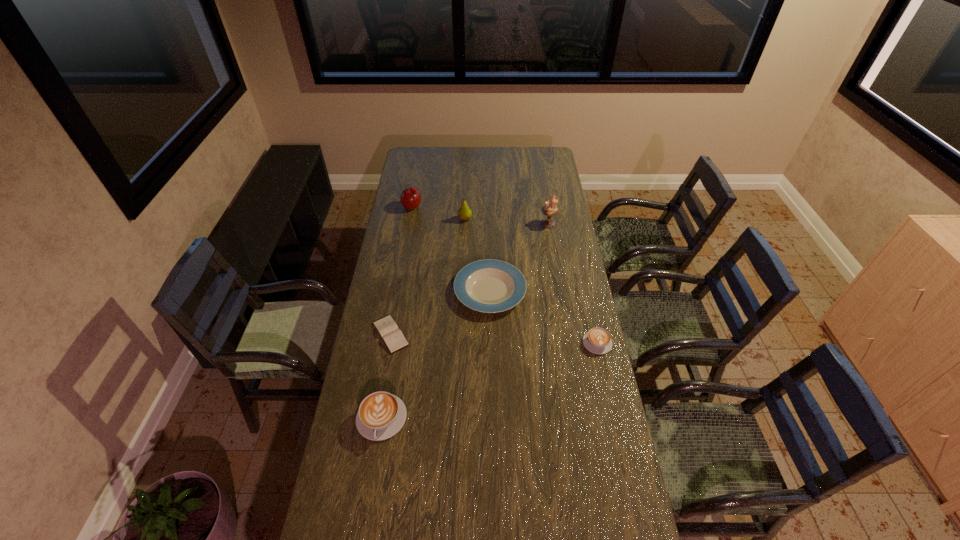
This screenshot has height=540, width=960. I want to click on the nearest object, so click(x=381, y=415).

Locate an element on the screen. Image resolution: width=960 pixels, height=540 pixels. the taller cappuccino is located at coordinates (381, 415).

Where is `the farther cappuccino`? This screenshot has height=540, width=960. the farther cappuccino is located at coordinates (597, 340).

Where is `the shorter cappuccino`? the shorter cappuccino is located at coordinates (597, 340).

What are the coordinates of `pear` in the screenshot? It's located at tap(465, 213).

Image resolution: width=960 pixels, height=540 pixels. In order to click on the sixth object from left to right in this screenshot , I will do [549, 210].

I want to click on the tallest object, so click(x=549, y=210).

Where is `apple`? This screenshot has height=540, width=960. apple is located at coordinates (410, 198).

I want to click on plate, so click(x=489, y=286).

I want to click on the shortest object, so click(x=392, y=336).